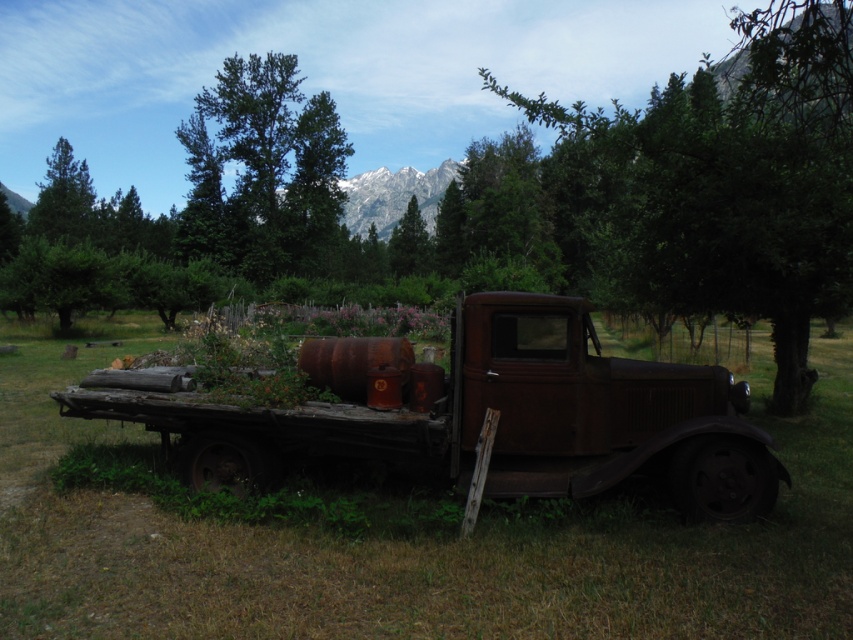
You are a bird looking for a place to perch. You see the green leafy tree at upper center and the green matte tree at center. Which tree has a wider canopy for you to land on?

The green leafy tree at upper center might be wider than green matte tree at center, so it has a wider canopy for you to land on.